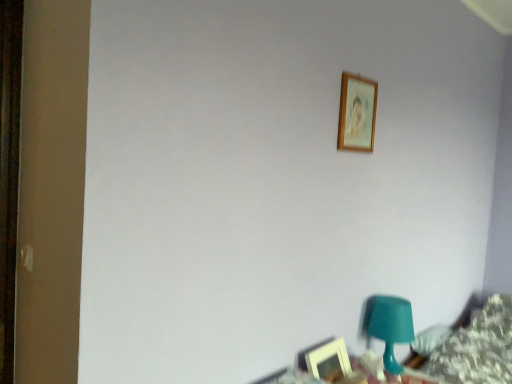
Question: Is wooden picture frame at lower right, placed as the first picture frame when sorted from bottom to top, touching teal plastic table at lower right?

Choices:
 (A) yes
 (B) no

Answer: (B)

Question: Considering the relative sizes of wooden picture frame at lower right, placed as the first picture frame when sorted from bottom to top, and teal plastic table at lower right in the image provided, is wooden picture frame at lower right, placed as the first picture frame when sorted from bottom to top, wider than teal plastic table at lower right?

Choices:
 (A) yes
 (B) no

Answer: (B)

Question: Does wooden picture frame at lower right, placed as the first picture frame when sorted from bottom to top, appear on the left side of teal plastic table at lower right?

Choices:
 (A) no
 (B) yes

Answer: (B)

Question: Is wooden picture frame at lower right, which ranks as the second picture frame in top-to-bottom order, in front of teal plastic table at lower right?

Choices:
 (A) no
 (B) yes

Answer: (A)

Question: Can you confirm if wooden picture frame at lower right, placed as the first picture frame when sorted from bottom to top, is smaller than teal plastic table at lower right?

Choices:
 (A) no
 (B) yes

Answer: (B)

Question: Is wooden picture frame at lower right, which ranks as the second picture frame in top-to-bottom order, positioned beyond the bounds of teal plastic table at lower right?

Choices:
 (A) no
 (B) yes

Answer: (B)

Question: Is wooden picture frame at lower right, which ranks as the second picture frame in top-to-bottom order, further to the viewer compared to teal plastic table lamp at lower right?

Choices:
 (A) yes
 (B) no

Answer: (B)

Question: Is wooden picture frame at lower right, which ranks as the second picture frame in top-to-bottom order, positioned beyond the bounds of teal plastic table lamp at lower right?

Choices:
 (A) yes
 (B) no

Answer: (A)

Question: Does wooden picture frame at lower right, placed as the first picture frame when sorted from bottom to top, lie in front of teal plastic table lamp at lower right?

Choices:
 (A) no
 (B) yes

Answer: (B)

Question: Is wooden picture frame at lower right, which ranks as the second picture frame in top-to-bottom order, at the left side of teal plastic table lamp at lower right?

Choices:
 (A) yes
 (B) no

Answer: (A)

Question: Can you confirm if wooden picture frame at lower right, which ranks as the second picture frame in top-to-bottom order, is positioned to the right of teal plastic table lamp at lower right?

Choices:
 (A) no
 (B) yes

Answer: (A)

Question: From a real-world perspective, is wooden picture frame at lower right, which ranks as the second picture frame in top-to-bottom order, located beneath teal plastic table lamp at lower right?

Choices:
 (A) no
 (B) yes

Answer: (B)

Question: Are wooden picture frame at upper center, which appears as the first picture frame when viewed from the top, and teal plastic table at lower right far apart?

Choices:
 (A) no
 (B) yes

Answer: (A)